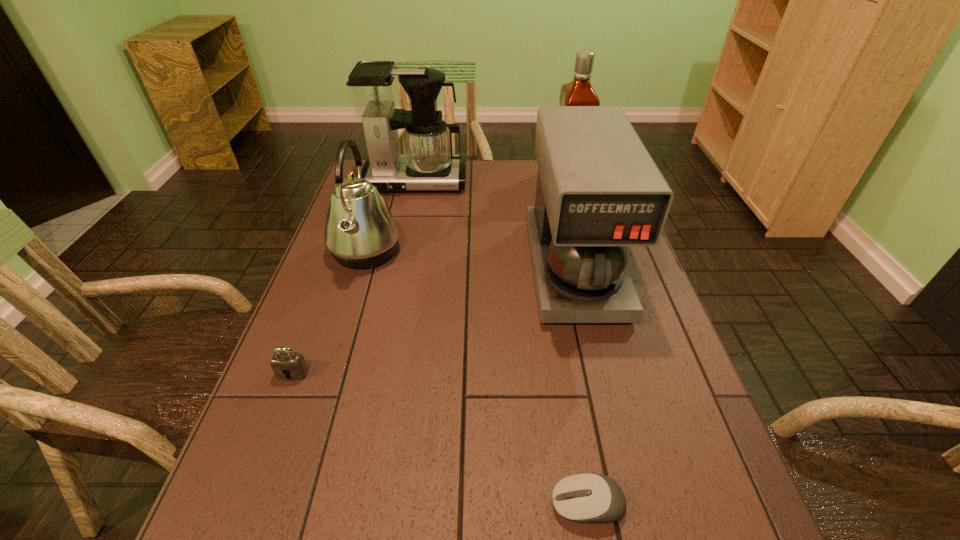
Where is `the fifth closest object to the liquor`? the fifth closest object to the liquor is located at coordinates (586, 497).

The image size is (960, 540). Identify the location of vacant point that satisfies the following two spatial constraints: 1. on the carafe side of the nearer coffee maker; 2. on the wheel side of the computer equipment. (632, 504).

The height and width of the screenshot is (540, 960). In order to click on vacant area that satisfies the following two spatial constraints: 1. on the front label of the liquor; 2. at the front of the left coffee maker where the controls are located in this screenshot , I will do `click(568, 181)`.

This screenshot has width=960, height=540. In order to click on vacant area that satisfies the following two spatial constraints: 1. on the front label of the liquor; 2. at the front of the farther coffee maker where the controls are located in this screenshot , I will do `click(568, 181)`.